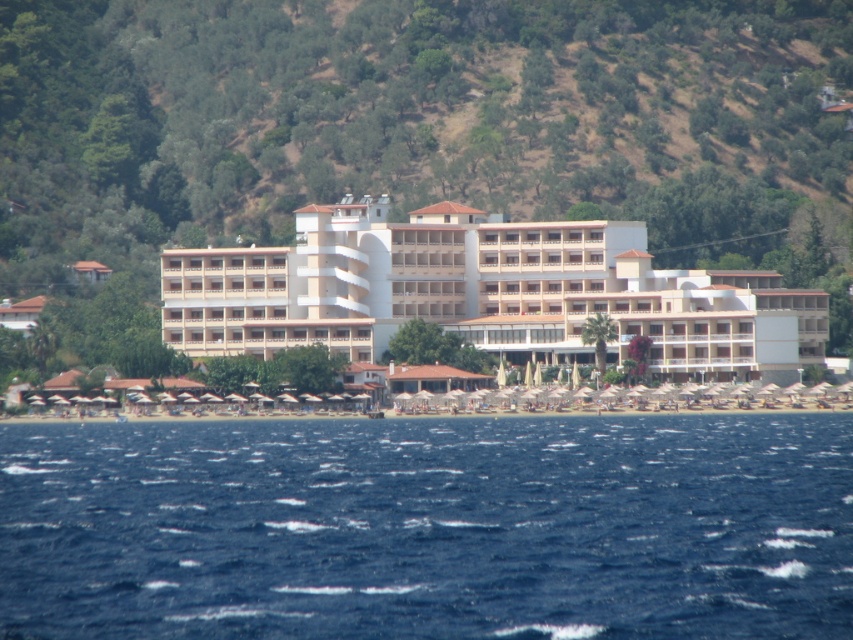
Question: Does blue water at lower center have a larger size compared to white matte building at center?

Choices:
 (A) yes
 (B) no

Answer: (B)

Question: Is blue water at lower center below white matte building at center?

Choices:
 (A) no
 (B) yes

Answer: (B)

Question: Which object appears closest to the camera in this image?

Choices:
 (A) white matte building at center
 (B) blue water at lower center

Answer: (B)

Question: Is blue water at lower center above white matte building at center?

Choices:
 (A) no
 (B) yes

Answer: (A)

Question: Which point is farther to the camera?

Choices:
 (A) white matte building at center
 (B) blue water at lower center

Answer: (A)

Question: Which point appears closest to the camera in this image?

Choices:
 (A) (489, 244)
 (B) (415, 461)

Answer: (B)